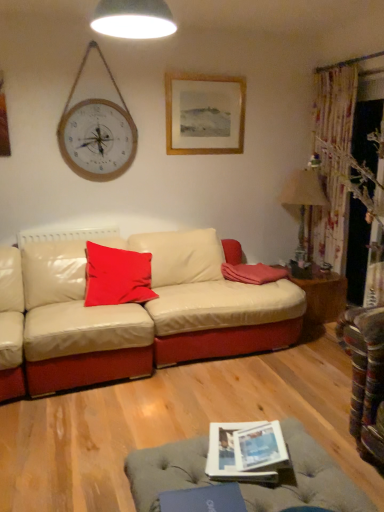
Question: From a real-world perspective, does matte paper magazine at lower center sit lower than matte red cushion at center, the 2th pillow from the right?

Choices:
 (A) no
 (B) yes

Answer: (B)

Question: Is matte paper magazine at lower center outside of matte red cushion at center, the 2th pillow from the right?

Choices:
 (A) no
 (B) yes

Answer: (B)

Question: Can you confirm if matte paper magazine at lower center is wider than matte red cushion at center, the 2th pillow from the right?

Choices:
 (A) yes
 (B) no

Answer: (B)

Question: From the image's perspective, is matte paper magazine at lower center above matte red cushion at center, which is counted as the 1th pillow, starting from the left?

Choices:
 (A) no
 (B) yes

Answer: (A)

Question: From the image's perspective, is matte paper magazine at lower center below matte red cushion at center, which is counted as the 1th pillow, starting from the left?

Choices:
 (A) yes
 (B) no

Answer: (A)

Question: Considering the positions of point (86, 247) and point (291, 197), is point (86, 247) closer or farther from the camera than point (291, 197)?

Choices:
 (A) farther
 (B) closer

Answer: (B)

Question: In terms of size, does matte red cushion at center, which is counted as the 1th pillow, starting from the left, appear bigger or smaller than beige fabric lampshade at right, the second lamp viewed from the front?

Choices:
 (A) big
 (B) small

Answer: (B)

Question: In the image, is matte red cushion at center, which is counted as the 1th pillow, starting from the left, on the left side or the right side of beige fabric lampshade at right, which appears as the first lamp when viewed from the back?

Choices:
 (A) left
 (B) right

Answer: (A)

Question: Is matte red cushion at center, which is counted as the 1th pillow, starting from the left, wider or thinner than beige fabric lampshade at right, which appears as the 1th lamp when ordered from the bottom?

Choices:
 (A) wide
 (B) thin

Answer: (A)

Question: Looking at their shapes, would you say white glossy lampshade at upper center, placed as the 1th lamp when sorted from front to back, is wider or thinner than matte red cushion at center, the 2th pillow from the right?

Choices:
 (A) thin
 (B) wide

Answer: (A)

Question: Considering the positions of point (157, 24) and point (147, 273), is point (157, 24) closer or farther from the camera than point (147, 273)?

Choices:
 (A) closer
 (B) farther

Answer: (B)

Question: Visually, is white glossy lampshade at upper center, acting as the first lamp starting from the left, positioned to the left or to the right of matte red cushion at center, the 2th pillow from the right?

Choices:
 (A) right
 (B) left

Answer: (A)

Question: Is white glossy lampshade at upper center, placed as the 1th lamp when sorted from front to back, inside the boundaries of matte red cushion at center, the 2th pillow from the right, or outside?

Choices:
 (A) outside
 (B) inside

Answer: (A)

Question: Considering their positions, is wooden framed picture at upper center located in front of or behind matte paper magazine at lower center?

Choices:
 (A) front
 (B) behind

Answer: (B)

Question: Do you think wooden framed picture at upper center is within matte paper magazine at lower center, or outside of it?

Choices:
 (A) inside
 (B) outside

Answer: (B)